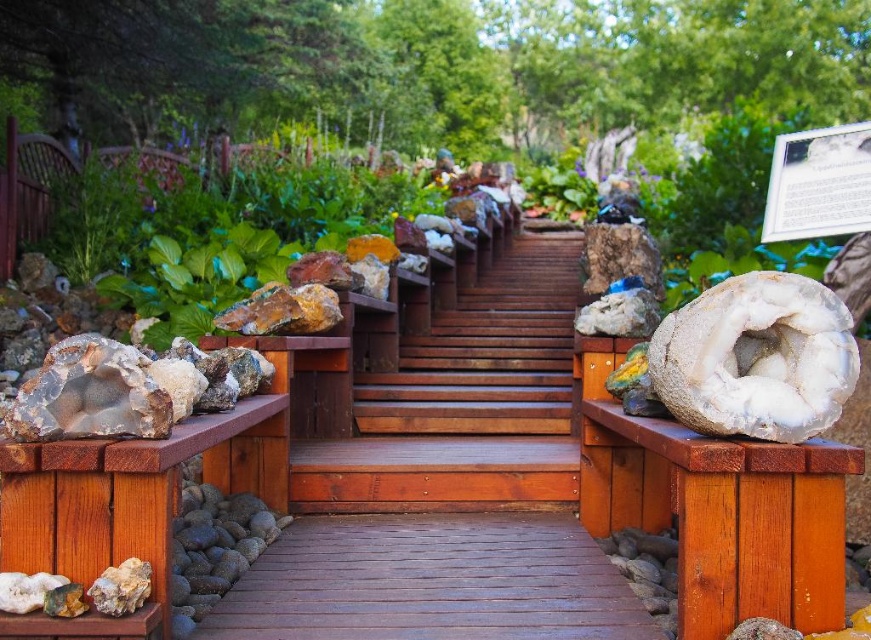
Question: Which of the following is the closest to the observer?

Choices:
 (A) gray rock at lower left
 (B) translucent white crystal at center
 (C) smooth wooden path at center
 (D) brown wooden stairs at center

Answer: (B)

Question: Is translucent white crystal at center below gray rock at lower left?

Choices:
 (A) yes
 (B) no

Answer: (B)

Question: Can you confirm if translucent white crystal at center is positioned below gray rock at lower left?

Choices:
 (A) yes
 (B) no

Answer: (B)

Question: Considering the real-world distances, which object is farthest from the smooth wooden path at center?

Choices:
 (A) brown wooden stairs at center
 (B) gray rock at lower left
 (C) translucent white crystal at center

Answer: (A)

Question: Among these points, which one is farthest from the camera?

Choices:
 (A) (507, 307)
 (B) (217, 588)

Answer: (A)

Question: Is translucent white crystal at center bigger than gray rock at lower left?

Choices:
 (A) yes
 (B) no

Answer: (B)